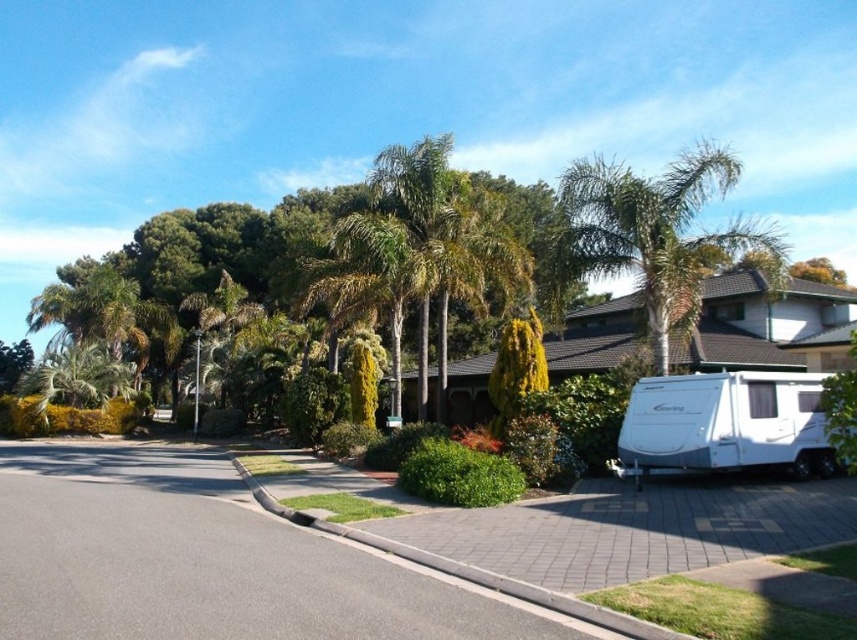
You are a delivery person trying to park your 2.5 meter wide delivery van between the green leafy palm tree at center and the white glossy caravan at lower right. Can you fit your van there?

The distance between the green leafy palm tree at center and the white glossy caravan at lower right is 9.50 meters. Since your van is 2.5 meters wide, there is sufficient space to park it between them.

You are a delivery driver who needs to park your vehicle, which is 6 meters long, in the driveway next to the white glossy caravan at lower right. The driveway is bordered by the green leafy palm tree at upper center. Is there enough space between the caravan and the palm tree to park your vehicle?

The distance between the green leafy palm tree at upper center and the white glossy caravan at lower right is 9.29 meters. Since your vehicle is 6 meters long, there is sufficient space to park between them.

You are a delivery person trying to determine the best path to avoid obstacles. Given the green leafy palm tree at upper center and the white glossy caravan at lower right, which object would you need to go around due to its larger size?

The green leafy palm tree at upper center is bigger than the white glossy caravan at lower right, so you would need to go around the green leafy palm tree at upper center due to its larger size.